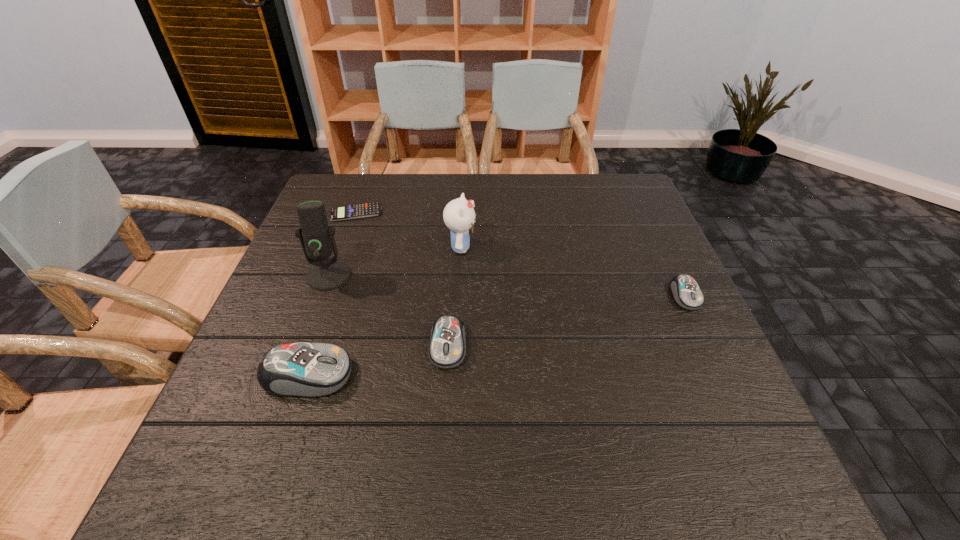
Identify the location of the fifth nearest object. (459, 216).

Where is `vacant area situated 0.170m on the wheel side of the tallest computer mouse`? Image resolution: width=960 pixels, height=540 pixels. vacant area situated 0.170m on the wheel side of the tallest computer mouse is located at coordinates (439, 375).

Identify the location of vacant space situated 0.060m on the wheel side of the fourth tallest object. (444, 397).

Locate an element on the screen. Image resolution: width=960 pixels, height=540 pixels. free space located 0.160m on the wheel side of the shortest computer mouse is located at coordinates (721, 371).

The image size is (960, 540). Identify the location of free space located 0.100m on the front of the farthest object. (345, 245).

Locate an element on the screen. The width and height of the screenshot is (960, 540). blank area located 0.100m on the right of the microphone is located at coordinates (392, 275).

Locate an element on the screen. The image size is (960, 540). free region located on the front-facing side of the fifth nearest object is located at coordinates (527, 247).

Image resolution: width=960 pixels, height=540 pixels. Find the location of `object situated at the far edge`. object situated at the far edge is located at coordinates (354, 211).

Locate an element on the screen. The height and width of the screenshot is (540, 960). object situated at the near edge is located at coordinates (299, 369).

I want to click on computer mouse present at the left edge, so click(299, 369).